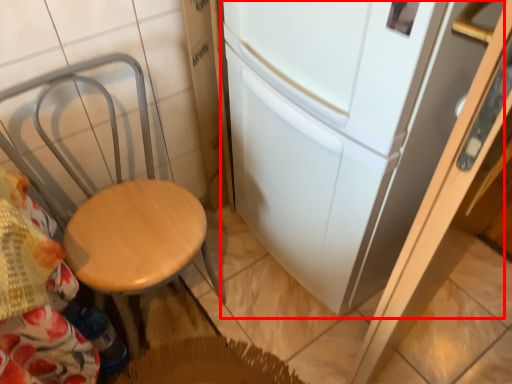
Question: Considering the relative positions of fridge (annotated by the red box) and chair in the image provided, where is fridge (annotated by the red box) located with respect to the staircase?

Choices:
 (A) left
 (B) right

Answer: (B)